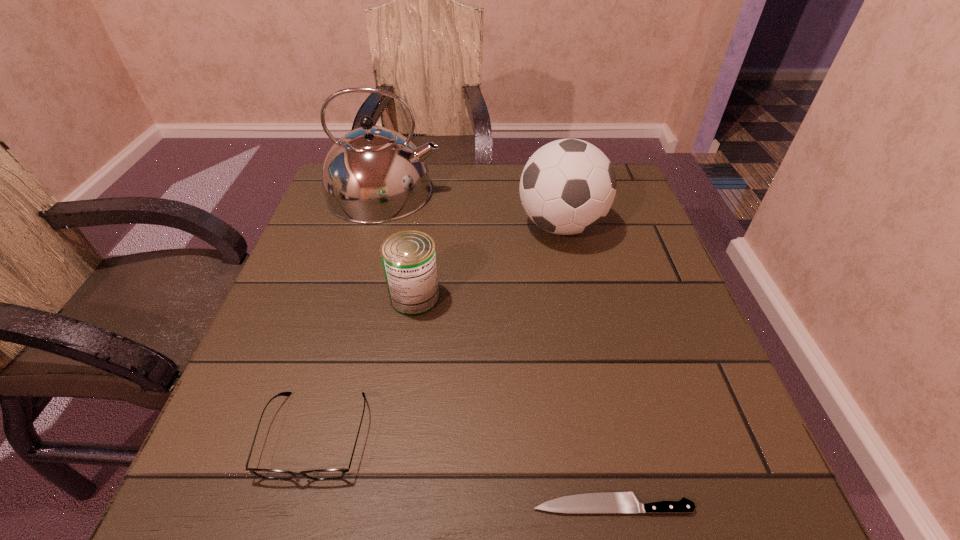
What are the coordinates of `blank space located 0.130m on the back of the can` in the screenshot? It's located at 423,241.

Find the location of `free location located 0.200m on the left of the steak knife`. free location located 0.200m on the left of the steak knife is located at coordinates (386, 504).

This screenshot has height=540, width=960. I want to click on kettle located in the far edge section of the desktop, so click(372, 175).

What are the coordinates of `soccer ball at the far edge` in the screenshot? It's located at (568, 186).

What are the coordinates of `spectacles that is at the near edge` in the screenshot? It's located at (322, 474).

The image size is (960, 540). I want to click on steak knife present at the near edge, so click(x=597, y=502).

At what (x,y) coordinates should I click in order to perform the action: click on kettle located at the left edge. Please return your answer as a coordinate pair (x, y). The width and height of the screenshot is (960, 540). Looking at the image, I should click on (372, 175).

Identify the location of spectacles that is at the left edge. (322, 474).

Locate an element on the screen. The height and width of the screenshot is (540, 960). soccer ball that is at the right edge is located at coordinates (568, 186).

The height and width of the screenshot is (540, 960). I want to click on steak knife that is at the right edge, so click(597, 502).